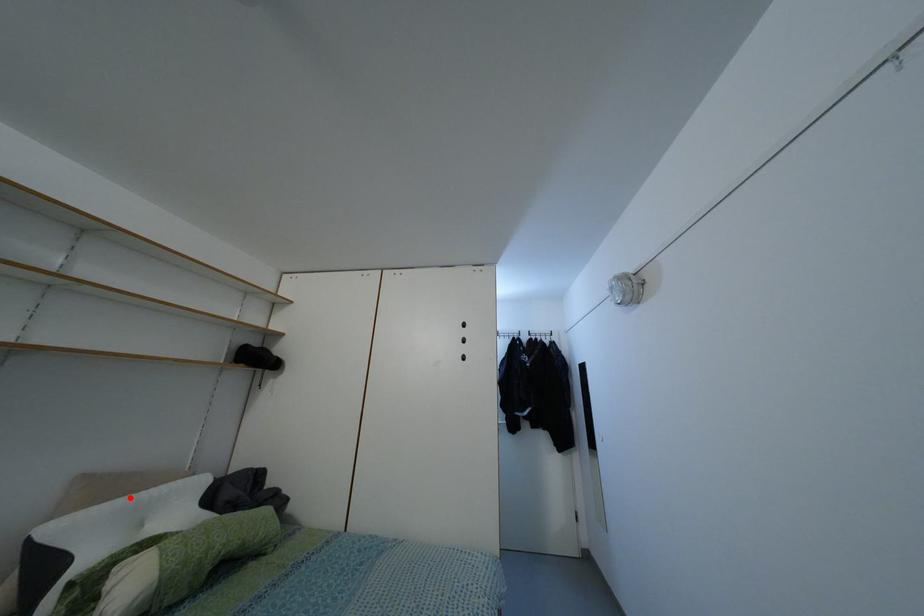
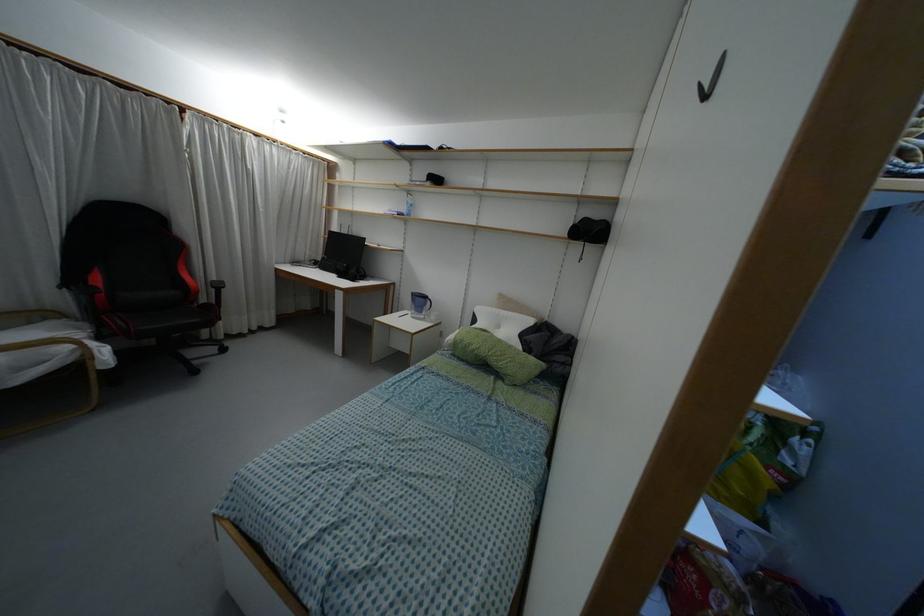
Find the pixel in the second image that matches the highlighted location in the first image.

(496, 310)